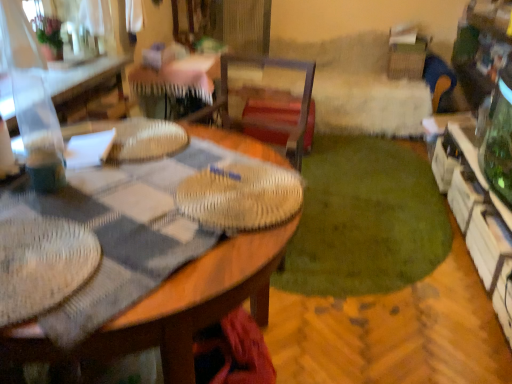
Question: From the image's perspective, is green plush rug at center located above or below white glossy cabinet at right?

Choices:
 (A) above
 (B) below

Answer: (A)

Question: Considering the positions of green plush rug at center and white glossy cabinet at right in the image, is green plush rug at center wider or thinner than white glossy cabinet at right?

Choices:
 (A) wide
 (B) thin

Answer: (A)

Question: Estimate the real-world distances between objects in this image. Which object is closer to the wooden table at upper left?

Choices:
 (A) white glossy cabinet at right
 (B) wooden desk at center
 (C) green plush rug at center

Answer: (B)

Question: Which is farther from the wooden table at upper left?

Choices:
 (A) green plush rug at center
 (B) white glossy cabinet at right
 (C) wooden desk at center

Answer: (B)